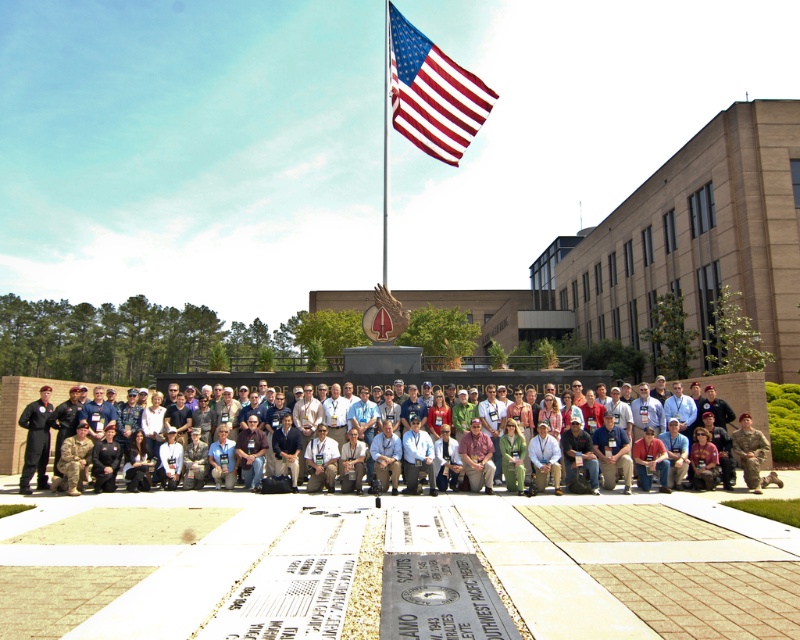
Can you confirm if red-white striped fabric flag at upper center is wider than camouflage uniform at center?

No, red-white striped fabric flag at upper center is not wider than camouflage uniform at center.

Who is positioned more to the left, red-white striped fabric flag at upper center or camouflage uniform at center?

From the viewer's perspective, camouflage uniform at center appears more on the left side.

Who is more forward, (396, 44) or (758, 419)?

Point (758, 419)

This screenshot has width=800, height=640. Identify the location of red-white striped fabric flag at upper center. (432, 92).

Looking at this image, is red-white striped fabric flag at upper center positioned in front of metallic flag pole at upper center?

No, red-white striped fabric flag at upper center is further to the viewer.

Between red-white striped fabric flag at upper center and metallic flag pole at upper center, which one has more height?

With more height is metallic flag pole at upper center.

The image size is (800, 640). Describe the element at coordinates (432, 92) in the screenshot. I see `red-white striped fabric flag at upper center` at that location.

I want to click on red-white striped fabric flag at upper center, so click(x=432, y=92).

Between camouflage uniform at center and metallic flag pole at upper center, which one has more height?

With more height is metallic flag pole at upper center.

Is camouflage uniform at center in front of metallic flag pole at upper center?

Yes, it is in front of metallic flag pole at upper center.

Identify the location of camouflage uniform at center. The height and width of the screenshot is (640, 800). (18, 413).